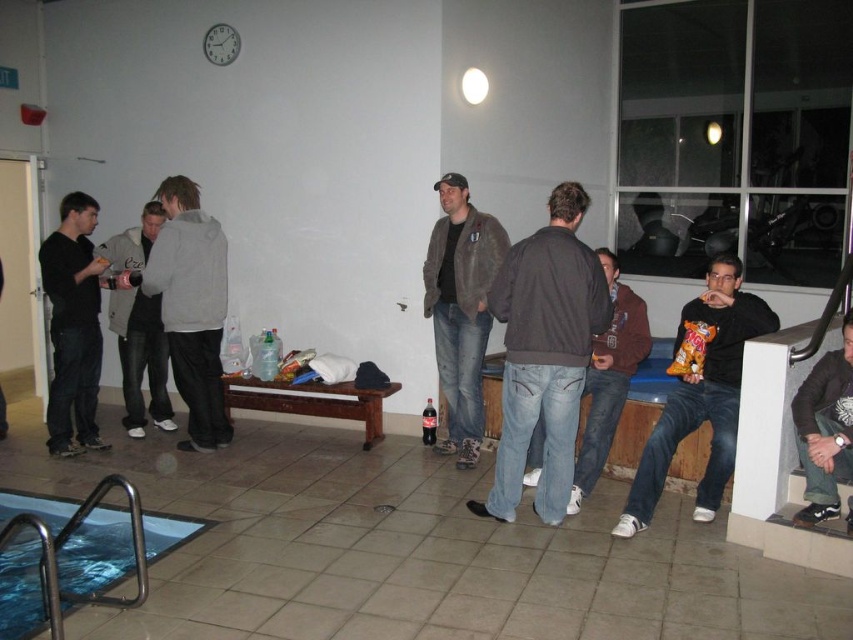
Is matte black hoodie at left thinner than dark red plastic bottle at center?

No.

This screenshot has width=853, height=640. What do you see at coordinates (73, 326) in the screenshot?
I see `matte black hoodie at left` at bounding box center [73, 326].

Is point (73, 397) behind point (432, 424)?

No, (73, 397) is closer to viewer.

Identify the location of matte black hoodie at left. (73, 326).

Is matte black hoodie at left bigger than brown leather jacket at center?

No.

Describe the element at coordinates (73, 326) in the screenshot. I see `matte black hoodie at left` at that location.

Does point (76, 198) lie in front of point (595, 388)?

No, it is not.

Find the location of a particular element. matte black hoodie at left is located at coordinates (73, 326).

Looking at this image, does dark gray hoodie at lower right have a greater width compared to dark red plastic bottle at center?

Indeed, dark gray hoodie at lower right has a greater width compared to dark red plastic bottle at center.

Is dark gray hoodie at lower right shorter than dark red plastic bottle at center?

Incorrect, dark gray hoodie at lower right's height does not fall short of dark red plastic bottle at center's.

The image size is (853, 640). What are the coordinates of `dark gray hoodie at lower right` in the screenshot? It's located at (825, 429).